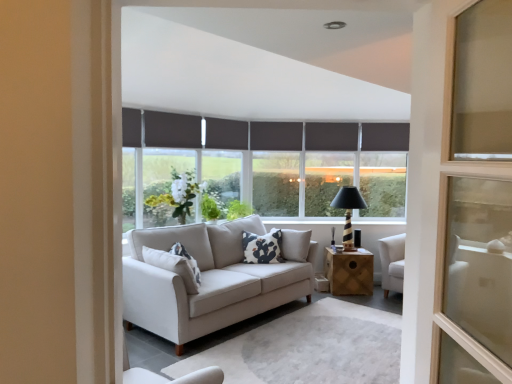
Question: Is dark grey fabric curtain at center, which is counted as the 2th curtain, starting from the left, taller than white printed cushion at center?

Choices:
 (A) yes
 (B) no

Answer: (B)

Question: Considering the relative sizes of dark grey fabric curtain at center, acting as the second curtain starting from the front, and white printed cushion at center in the image provided, is dark grey fabric curtain at center, acting as the second curtain starting from the front, thinner than white printed cushion at center?

Choices:
 (A) yes
 (B) no

Answer: (A)

Question: From a real-world perspective, is dark grey fabric curtain at center, acting as the second curtain starting from the front, on white printed cushion at center?

Choices:
 (A) yes
 (B) no

Answer: (A)

Question: Considering the relative sizes of dark grey fabric curtain at center, which is counted as the 2th curtain, starting from the left, and white printed cushion at center in the image provided, is dark grey fabric curtain at center, which is counted as the 2th curtain, starting from the left, shorter than white printed cushion at center?

Choices:
 (A) no
 (B) yes

Answer: (B)

Question: From a real-world perspective, does dark grey fabric curtain at center, which is the 2th curtain from back to front, sit lower than white printed cushion at center?

Choices:
 (A) yes
 (B) no

Answer: (B)

Question: Is white printed cushion at center wider or thinner than black striped wood table lamp at center?

Choices:
 (A) wide
 (B) thin

Answer: (B)

Question: From the image's perspective, is white printed cushion at center located above or below black striped wood table lamp at center?

Choices:
 (A) below
 (B) above

Answer: (A)

Question: Visually, is white printed cushion at center positioned to the left or to the right of black striped wood table lamp at center?

Choices:
 (A) right
 (B) left

Answer: (B)

Question: Is point (266, 248) closer or farther from the camera than point (346, 213)?

Choices:
 (A) closer
 (B) farther

Answer: (A)

Question: Considering the positions of dark grey fabric curtain at center, placed as the 1th curtain when sorted from right to left, and black striped wood table lamp at center in the image, is dark grey fabric curtain at center, placed as the 1th curtain when sorted from right to left, wider or thinner than black striped wood table lamp at center?

Choices:
 (A) wide
 (B) thin

Answer: (B)

Question: From a real-world perspective, relative to black striped wood table lamp at center, is dark grey fabric curtain at center, placed as the 1th curtain when sorted from right to left, vertically above or below?

Choices:
 (A) above
 (B) below

Answer: (A)

Question: Would you say dark grey fabric curtain at center, the third curtain positioned from the left, is to the left or to the right of black striped wood table lamp at center in the picture?

Choices:
 (A) right
 (B) left

Answer: (B)

Question: Based on their sizes in the image, would you say dark grey fabric curtain at center, placed as the 1th curtain when sorted from right to left, is bigger or smaller than black striped wood table lamp at center?

Choices:
 (A) big
 (B) small

Answer: (B)

Question: From a real-world perspective, relative to dark gray roller blind at upper center, arranged as the fifth window when viewed from the left, is dark grey fabric curtain at center, the third curtain positioned from the left, vertically above or below?

Choices:
 (A) below
 (B) above

Answer: (B)

Question: Considering the positions of dark grey fabric curtain at center, placed as the 1th curtain when sorted from right to left, and dark gray roller blind at upper center, arranged as the fifth window when viewed from the left, in the image, is dark grey fabric curtain at center, placed as the 1th curtain when sorted from right to left, taller or shorter than dark gray roller blind at upper center, arranged as the fifth window when viewed from the left,?

Choices:
 (A) tall
 (B) short

Answer: (B)